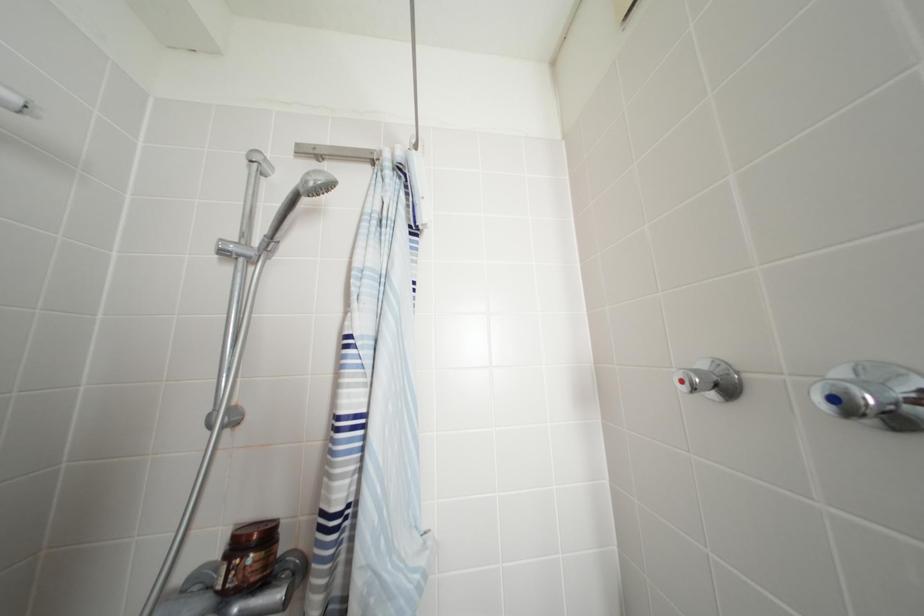
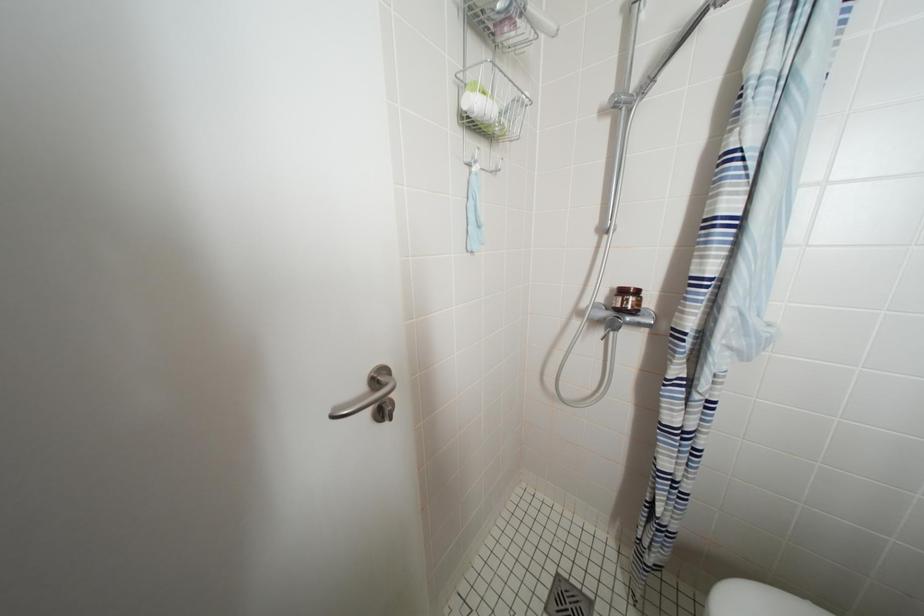
First-person continuous shooting, in which direction is the camera rotating?

The rotation direction of the camera is left-down.